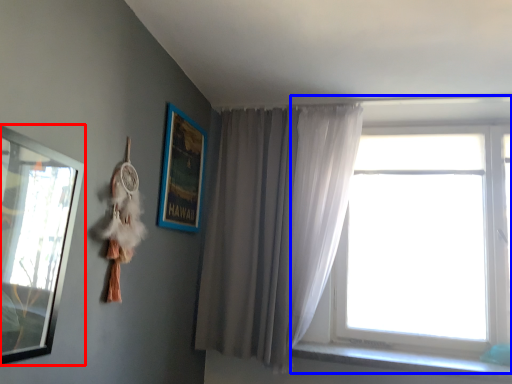
Question: Which of the following is the closest to the observer, picture frame (highlighted by a red box) or window (highlighted by a blue box)?

Choices:
 (A) picture frame
 (B) window

Answer: (A)